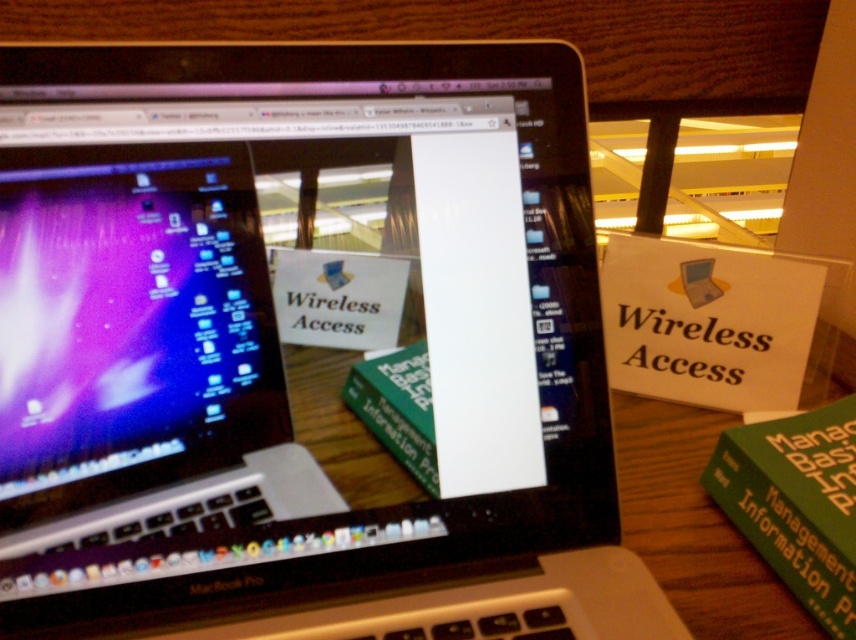
Question: Does matte black laptop at left come in front of green matte book at lower right?

Choices:
 (A) no
 (B) yes

Answer: (B)

Question: Can you confirm if matte black laptop at left is thinner than green matte book at lower right?

Choices:
 (A) yes
 (B) no

Answer: (B)

Question: Which point is closer to the camera?

Choices:
 (A) green matte book at lower right
 (B) matte black laptop at left

Answer: (B)

Question: Does matte black laptop at left appear on the left side of green matte book at lower right?

Choices:
 (A) no
 (B) yes

Answer: (B)

Question: Which point is closer to the camera?

Choices:
 (A) matte black laptop at left
 (B) green matte book at lower right

Answer: (A)